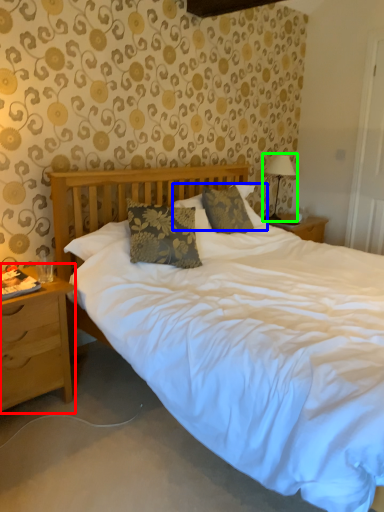
Question: Based on their relative distances, which object is nearer to nightstand (highlighted by a red box)? Choose from pillow (highlighted by a blue box) and table lamp (highlighted by a green box).

Choices:
 (A) pillow
 (B) table lamp

Answer: (A)